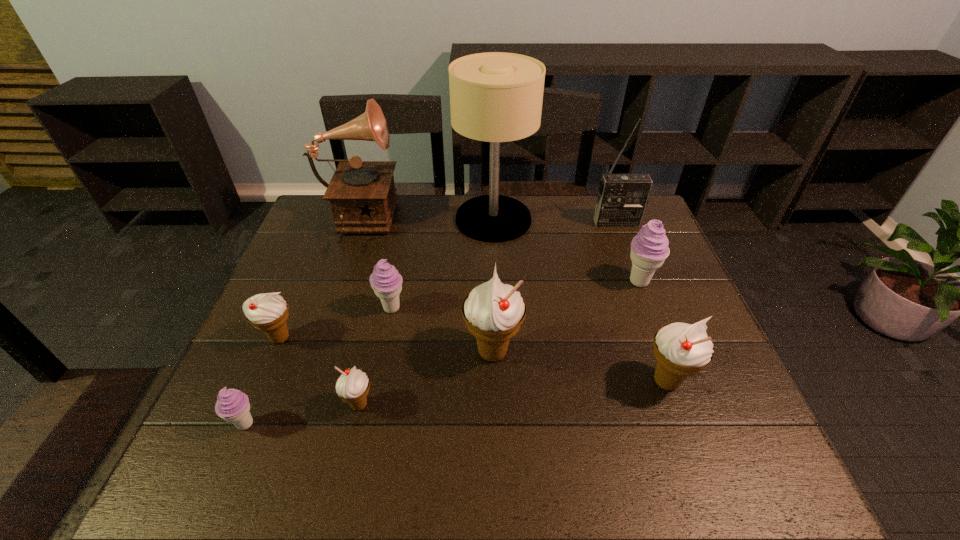
Identify the location of object at the far left corner. (362, 194).

Identify the location of object that is positioned at the far right corner. This screenshot has height=540, width=960. click(x=622, y=199).

In the image, there is a desktop. At what (x,y) coordinates should I click in order to perform the action: click on vacant area at the far edge. Please return your answer as a coordinate pair (x, y). Looking at the image, I should click on (431, 232).

The image size is (960, 540). I want to click on free location at the near edge, so click(614, 484).

At what (x,y) coordinates should I click in order to perform the action: click on vacant position at the far left corner of the desktop. Please return your answer as a coordinate pair (x, y). Looking at the image, I should click on (303, 225).

The width and height of the screenshot is (960, 540). I want to click on blank space at the near left corner of the desktop, so click(x=277, y=443).

The image size is (960, 540). I want to click on free spot between the second farthest purple icecream and the second white icecream from left to right, so click(375, 356).

Locate an element on the screen. unoccupied area between the third white icecream from left to right and the sixth nearest icecream is located at coordinates 442,330.

The width and height of the screenshot is (960, 540). What are the coordinates of `vacant area that lies between the fifth icecream from left to right and the second biggest purple icecream` in the screenshot? It's located at (442, 330).

At what (x,y) coordinates should I click in order to perform the action: click on free spot between the third smallest white icecream and the leftmost white icecream. Please return your answer as a coordinate pair (x, y). The width and height of the screenshot is (960, 540). Looking at the image, I should click on click(473, 360).